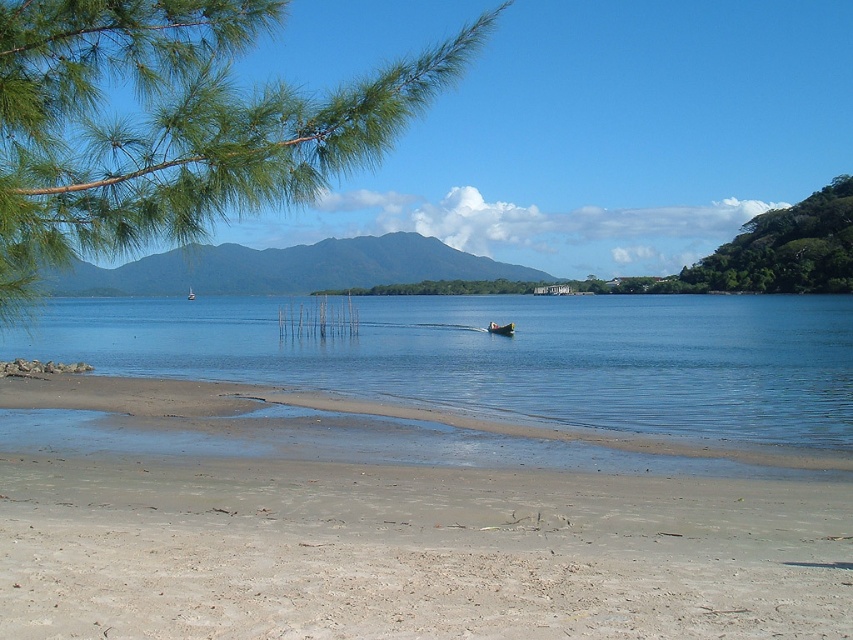
Question: Is green leafy branch at upper left bigger than wooden boat at center?

Choices:
 (A) yes
 (B) no

Answer: (A)

Question: Which object is positioned closest to the white plastic boat at center?

Choices:
 (A) sandy at lower left
 (B) green leafy branch at upper left

Answer: (B)

Question: Which object is closer to the camera taking this photo?

Choices:
 (A) green leafy tree at upper right
 (B) wooden boat at center

Answer: (B)

Question: In this image, where is sandy at lower left located relative to white plastic boat at center?

Choices:
 (A) above
 (B) below

Answer: (B)

Question: Which point is farther to the camera?

Choices:
 (A) (465, 56)
 (B) (498, 326)
 (C) (508, 566)
 (D) (804, 228)

Answer: (D)

Question: Where is green leafy branch at upper left located in relation to green leafy tree at upper right in the image?

Choices:
 (A) below
 (B) above

Answer: (B)